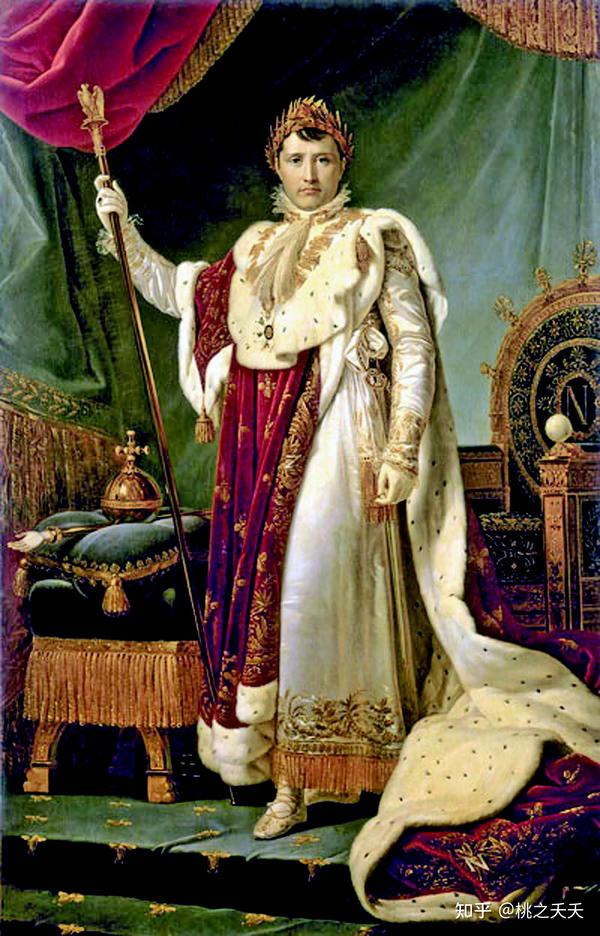
The width and height of the screenshot is (600, 936). What are the coordinates of `pillow` in the screenshot? It's located at (130, 553).